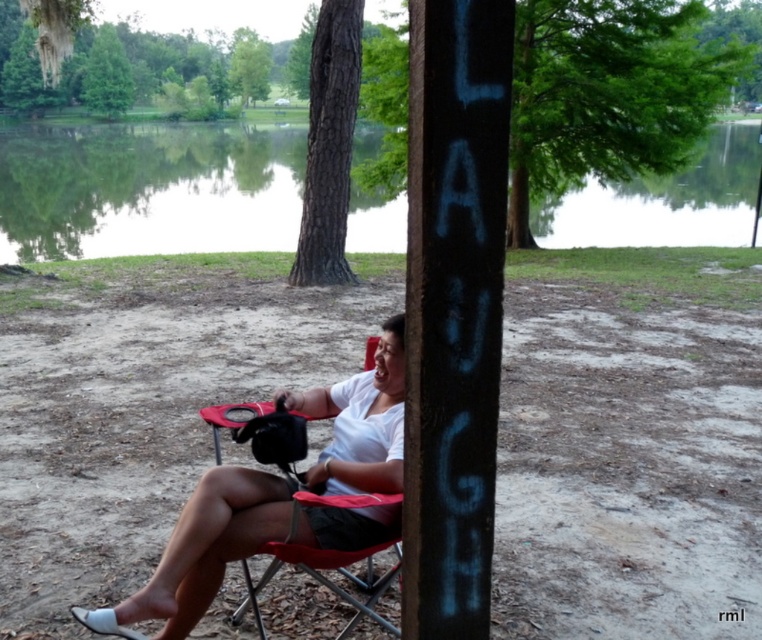
Based on the photo, you are a photographer standing at the location of the person in the image. You want to capture a photo that includes both the green reflective water at upper center and the dark brown bark tree at upper center in the same frame. Given your camera has a maximum focal length allowing a field of view that can cover 18 meters between two objects, will you be able to include both in your shot?

The green reflective water at upper center and dark brown bark tree at upper center are 17.98 meters apart from each other. Since the distance between them is less than the 18 meters your camera can cover, you can include both in the same frame.

You are standing at the point labeled as point [146,189] in the image. Looking around, you see the red folding chair and the vertical wooden post with the word LAUGH. Which object is closer to you?

The point corresponds to green reflective water at upper center, so the green reflective water at upper center is closer to you than the red folding chair and the vertical wooden post with the word LAUGH.